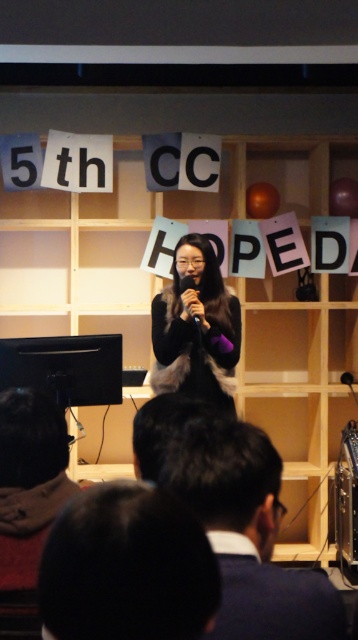
Can you confirm if wooden bookshelf at center is positioned above matte black microphone at center?

Actually, wooden bookshelf at center is below matte black microphone at center.

What do you see at coordinates (137, 234) in the screenshot? The height and width of the screenshot is (640, 358). I see `wooden bookshelf at center` at bounding box center [137, 234].

Locate an element on the screen. Image resolution: width=358 pixels, height=640 pixels. wooden bookshelf at center is located at coordinates (137, 234).

Is black hair at lower center smaller than black matte fur coat at center?

Yes.

How distant is black hair at lower center from black matte fur coat at center?

They are 2.36 meters apart.

The image size is (358, 640). What do you see at coordinates (127, 566) in the screenshot?
I see `black hair at lower center` at bounding box center [127, 566].

Locate an element on the screen. This screenshot has width=358, height=640. black hair at lower center is located at coordinates (127, 566).

Is dark hair at center closer to the viewer compared to brown fuzzy jacket at lower left?

That is True.

Which of these two, dark hair at center or brown fuzzy jacket at lower left, stands shorter?

dark hair at center is shorter.

Who is more distant from viewer, (284,605) or (30,513)?

Point (30,513)

This screenshot has width=358, height=640. Find the location of `dark hair at center`. dark hair at center is located at coordinates (248, 534).